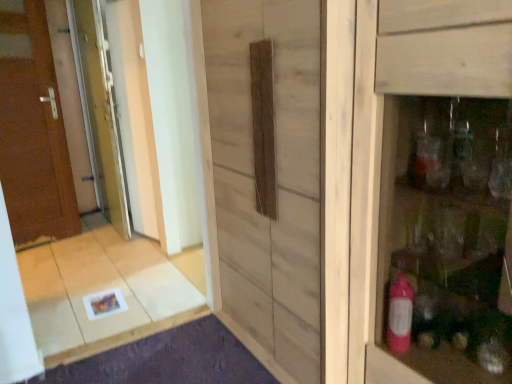
Question: From the image's perspective, is matte wooden cabinet at right positioned above or below natural wood barn door at center?

Choices:
 (A) below
 (B) above

Answer: (A)

Question: Looking at their shapes, would you say matte wooden cabinet at right is wider or thinner than natural wood barn door at center?

Choices:
 (A) thin
 (B) wide

Answer: (A)

Question: Estimate the real-world distances between objects in this image. Which object is closer to the clear glass screen door at left, the second screen door viewed from the right?

Choices:
 (A) clear glass screen door at left, acting as the 2th screen door starting from the left
 (B) natural wood barn door at center
 (C) brown wooden door at left
 (D) matte wooden cabinet at right

Answer: (A)

Question: Based on their relative distances, which object is farther from the clear glass screen door at left, which is the first screen door from right to left?

Choices:
 (A) matte wooden cabinet at right
 (B) natural wood barn door at center
 (C) brown wooden door at left
 (D) clear glass screen door at left, the second screen door viewed from the right

Answer: (A)